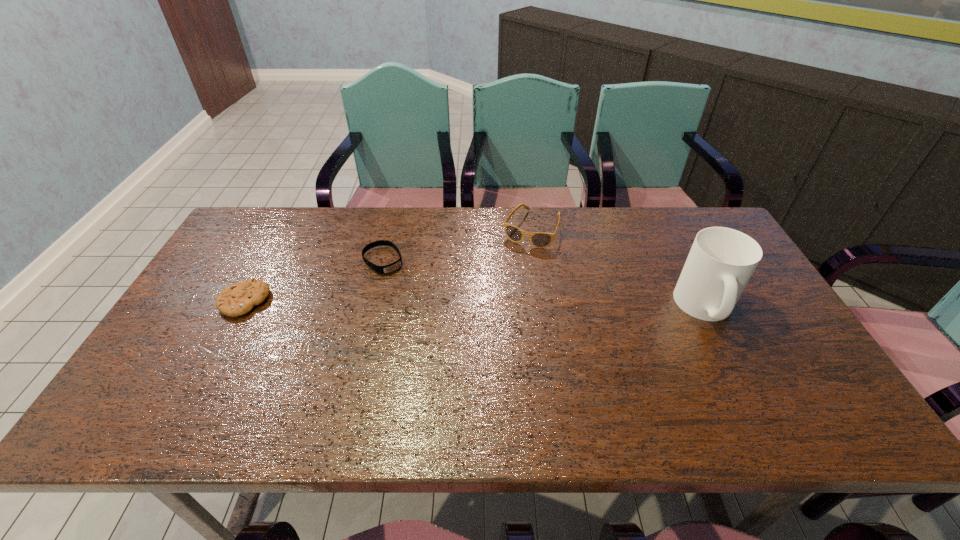
Locate an element on the screen. Image resolution: width=960 pixels, height=540 pixels. free space at the near edge of the desktop is located at coordinates (348, 371).

At what (x,y) coordinates should I click in order to perform the action: click on free location at the left edge. Please return your answer as a coordinate pair (x, y). The image size is (960, 540). Looking at the image, I should click on (179, 323).

Find the location of a particular element. Image resolution: width=960 pixels, height=540 pixels. free space at the right edge is located at coordinates 744,356.

Find the location of a particular element. The height and width of the screenshot is (540, 960). free space at the near left corner of the desktop is located at coordinates (207, 366).

The height and width of the screenshot is (540, 960). In order to click on free region at the near right corner of the desktop in this screenshot , I will do `click(759, 367)`.

At what (x,y) coordinates should I click in order to perform the action: click on vacant space in between the rightmost object and the third object from right to left. Please return your answer as a coordinate pair (x, y). The image size is (960, 540). Looking at the image, I should click on (544, 284).

Locate an element on the screen. The height and width of the screenshot is (540, 960). free space between the leftmost object and the mug is located at coordinates (475, 305).

Where is `vacant space in between the shortest object and the third shortest object`? The width and height of the screenshot is (960, 540). vacant space in between the shortest object and the third shortest object is located at coordinates (457, 245).

Locate an element on the screen. Image resolution: width=960 pixels, height=540 pixels. empty space between the rightmost object and the shortest object is located at coordinates (544, 284).

I want to click on free space between the rightmost object and the wristband, so click(544, 284).